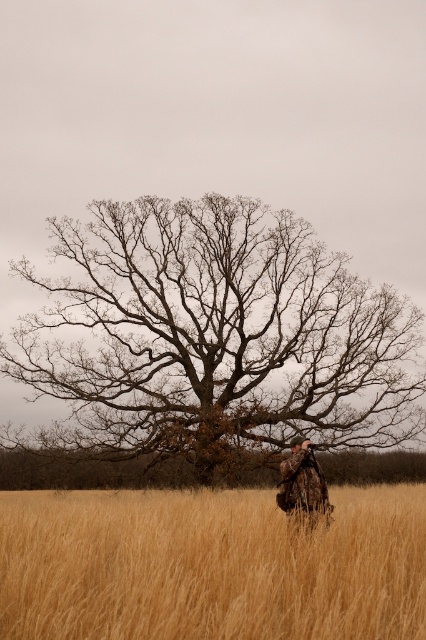
Does bare branches at center have a lesser height compared to camouflage fabric at center?

Incorrect, bare branches at center's height does not fall short of camouflage fabric at center's.

Which is more to the right, bare branches at center or camouflage fabric at center?

From the viewer's perspective, camouflage fabric at center appears more on the right side.

Identify the location of bare branches at center. This screenshot has width=426, height=640. (212, 339).

Does bare branches at center have a greater height compared to golden grass at center?

Yes.

Based on the photo, is bare branches at center to the left of golden grass at center from the viewer's perspective?

Correct, you'll find bare branches at center to the left of golden grass at center.

Is point (226, 212) positioned behind point (131, 547)?

Yes, point (226, 212) is behind point (131, 547).

Find the location of a particular element. bare branches at center is located at coordinates (212, 339).

Between golden grass at center and camouflage fabric at center, which one is positioned higher?

camouflage fabric at center

Find the location of a particular element. The height and width of the screenshot is (640, 426). golden grass at center is located at coordinates (210, 566).